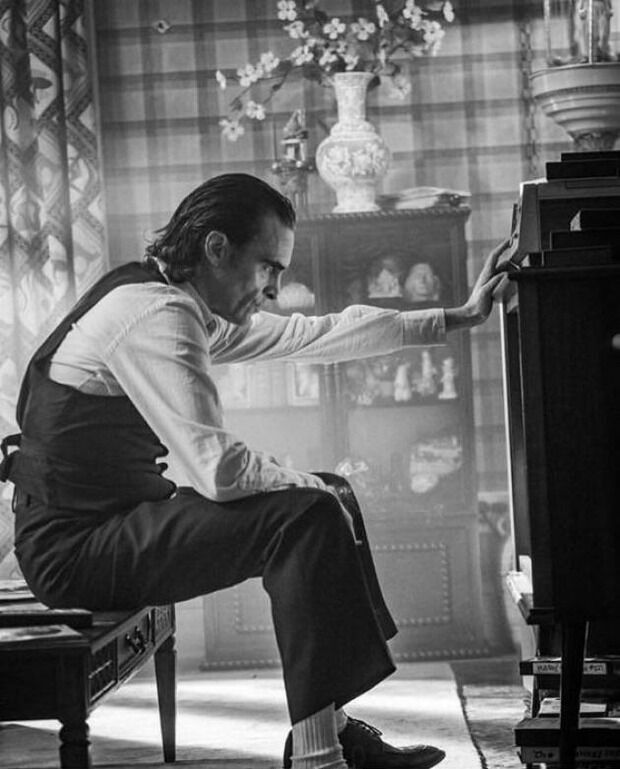
Locate an element on the screen. The height and width of the screenshot is (769, 620). pot is located at coordinates coord(347,130).